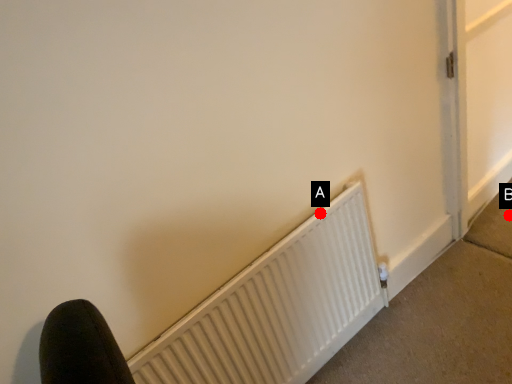
Question: Two points are circled on the image, labeled by A and B beside each circle. Which of the following is the closest to the observer?

Choices:
 (A) A is closer
 (B) B is closer

Answer: (A)